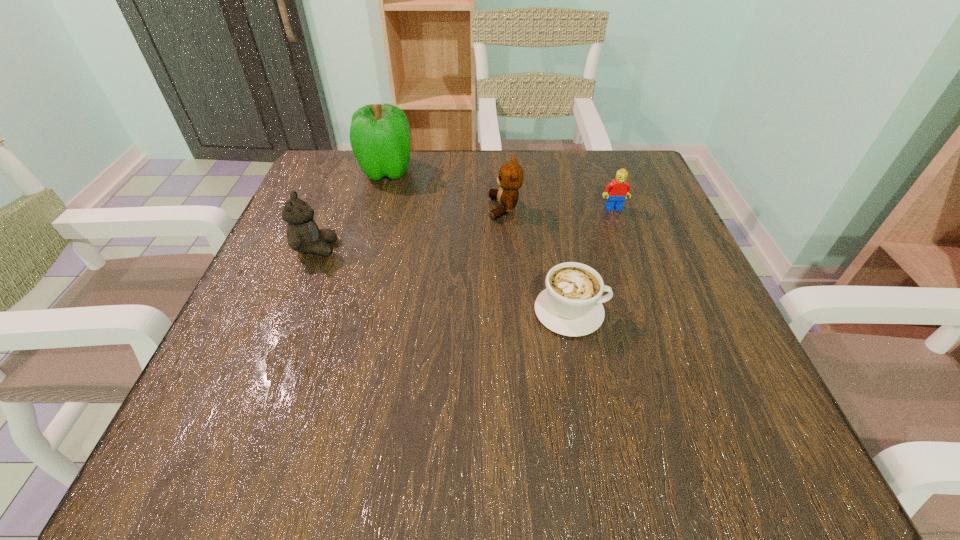
Locate an element on the screen. The height and width of the screenshot is (540, 960). vacant point located between the Lego and the second nearest object is located at coordinates (465, 228).

Where is `object that is the closest to the fourth farthest object`? object that is the closest to the fourth farthest object is located at coordinates (379, 134).

Locate an element on the screen. This screenshot has height=540, width=960. object that is the third closest to the Lego is located at coordinates (379, 134).

Locate an element on the screen. Image resolution: width=960 pixels, height=540 pixels. free space that satisfies the following two spatial constraints: 1. on the face of the second shortest object; 2. to the right of the nearest object's handle is located at coordinates (651, 311).

Identify the location of free location that satisfies the following two spatial constraints: 1. on the face of the Lego; 2. to the right of the nearest object's handle. (651, 311).